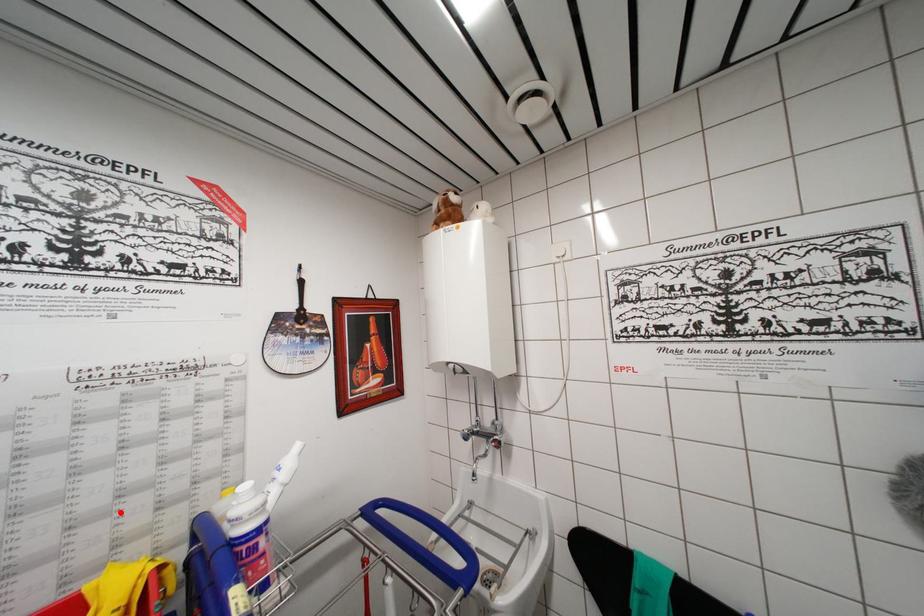
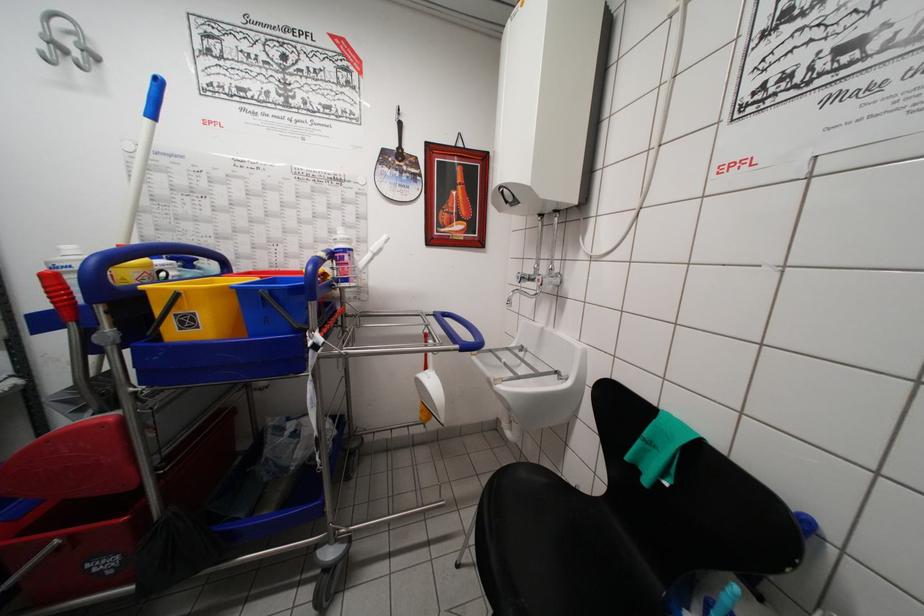
Where in the second image is the point corresponding to the highlighted location from the first image?

(319, 252)